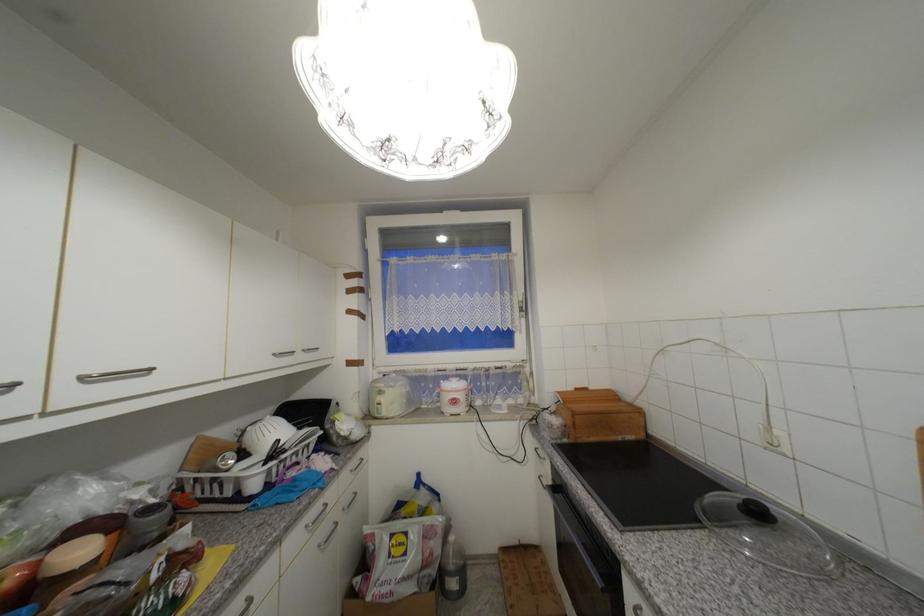
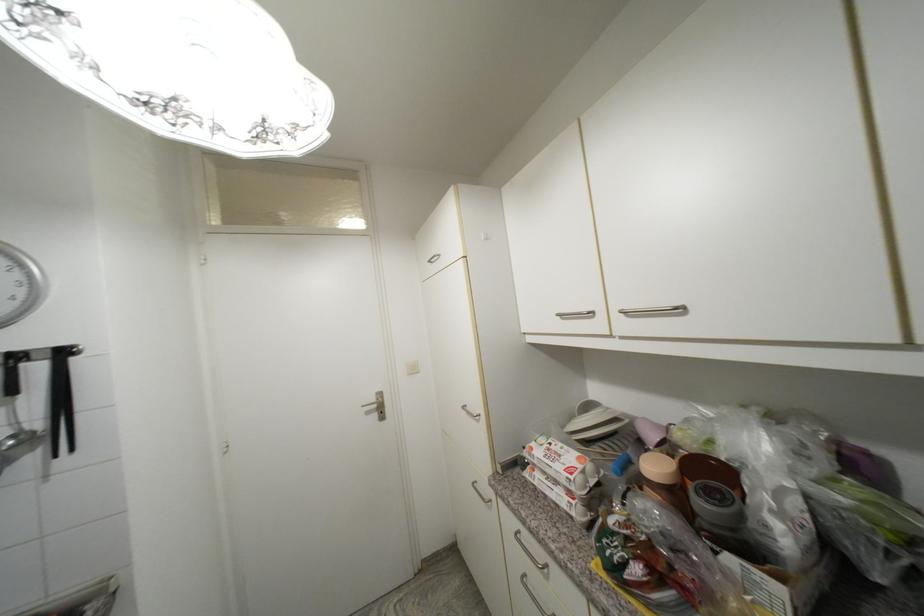
The point at (102,373) is marked in the first image. Where is the corresponding point in the second image?

(631, 309)